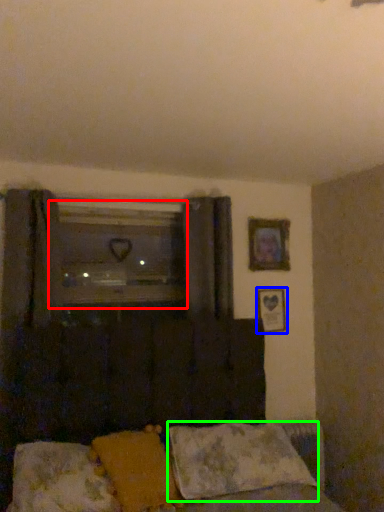
Question: Considering the real-world distances, which object is farthest from window (highlighted by a red box)? picture frame (highlighted by a blue box) or pillow (highlighted by a green box)?

Choices:
 (A) picture frame
 (B) pillow

Answer: (B)